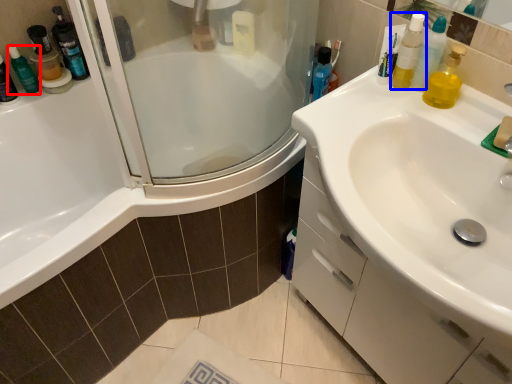
Question: Which object is further to the camera taking this photo, toiletry (highlighted by a red box) or mouthwash (highlighted by a blue box)?

Choices:
 (A) toiletry
 (B) mouthwash

Answer: (A)